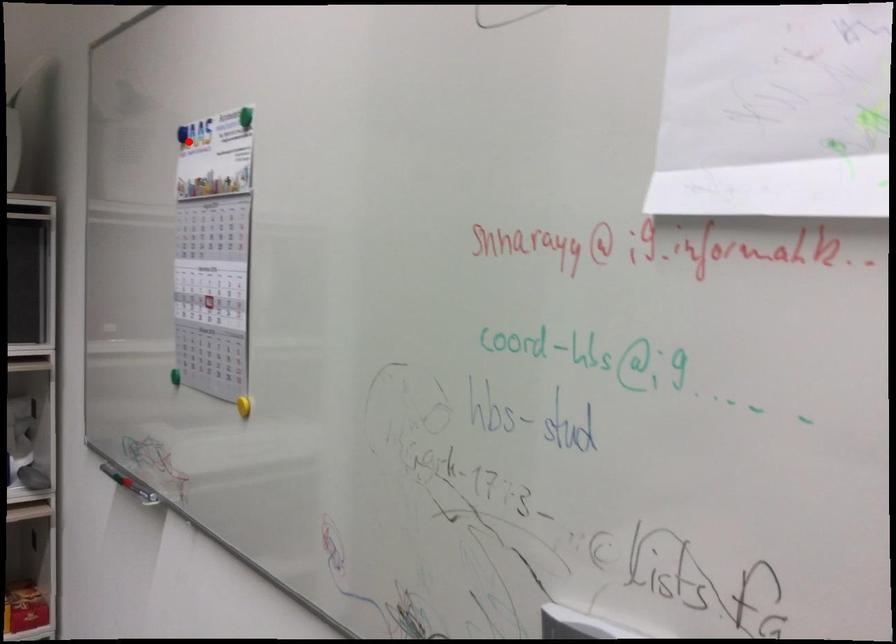
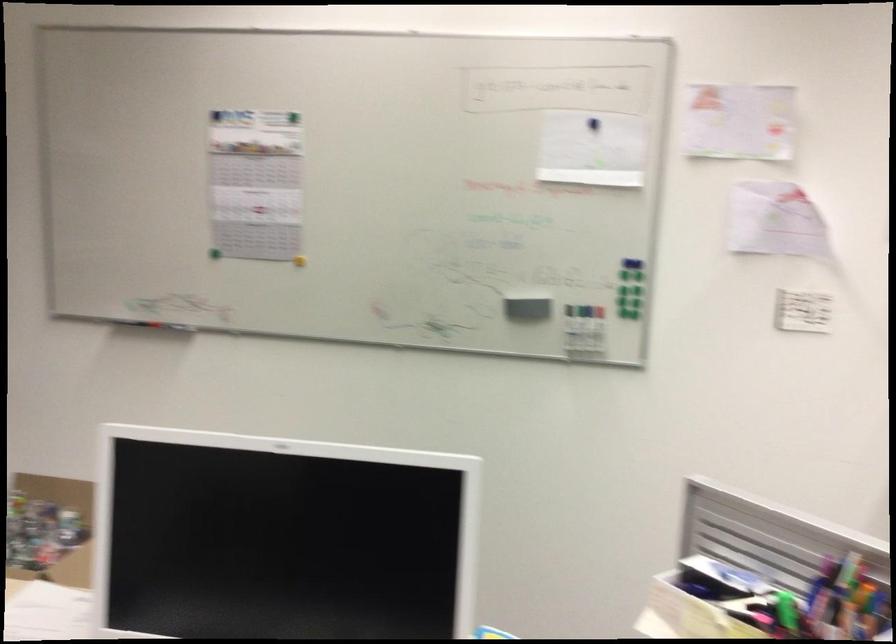
In the second image, find the point that corresponds to the highlighted location in the first image.

(216, 116)